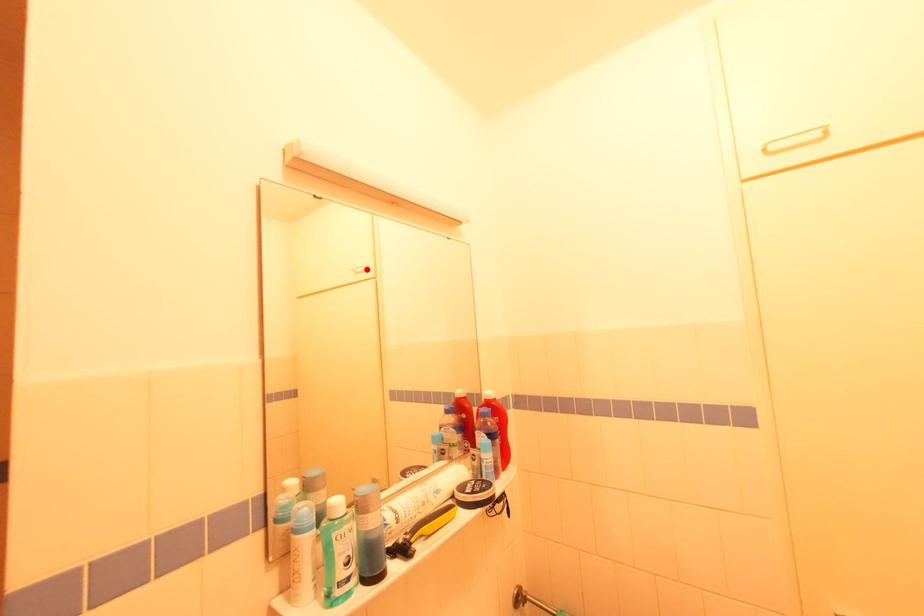
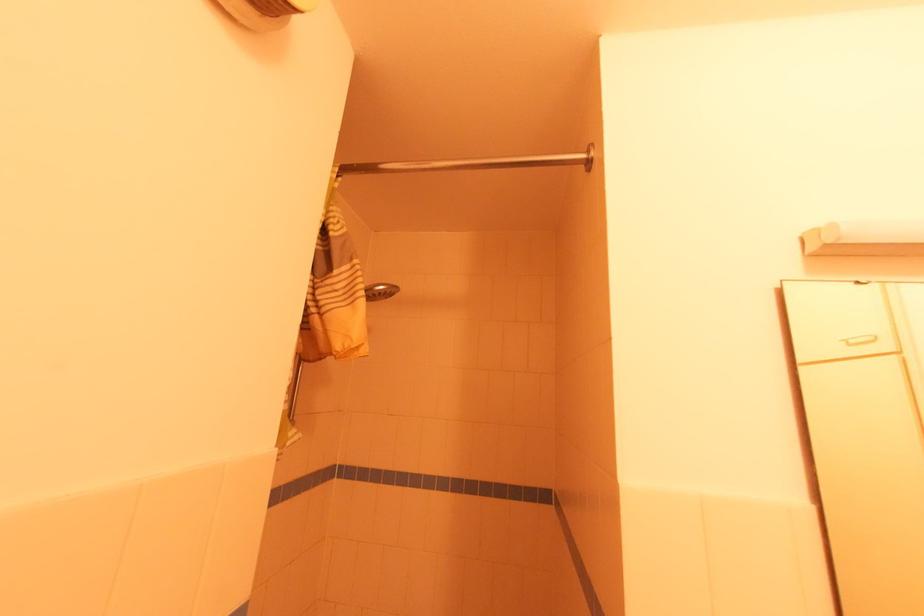
Find the pixel in the second image that matches the highlighted location in the first image.

(871, 339)